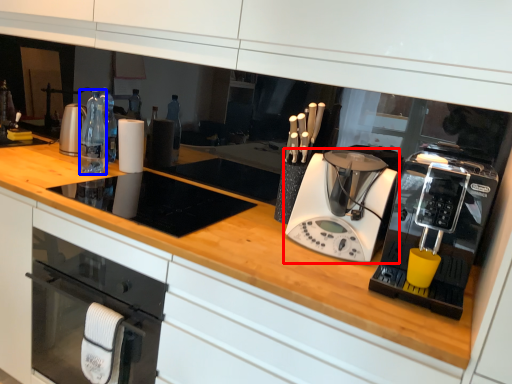
Question: Among these objects, which one is nearest to the camera, home appliance (highlighted by a red box) or bottle (highlighted by a blue box)?

Choices:
 (A) home appliance
 (B) bottle

Answer: (A)